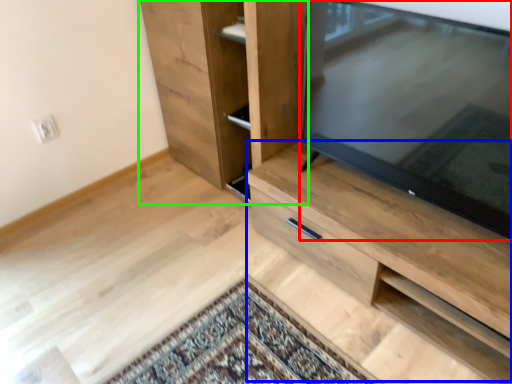
Question: Considering the real-world distances, which object is closest to television (highlighted by a red box)? cabinetry (highlighted by a blue box) or cupboard (highlighted by a green box).

Choices:
 (A) cabinetry
 (B) cupboard

Answer: (A)